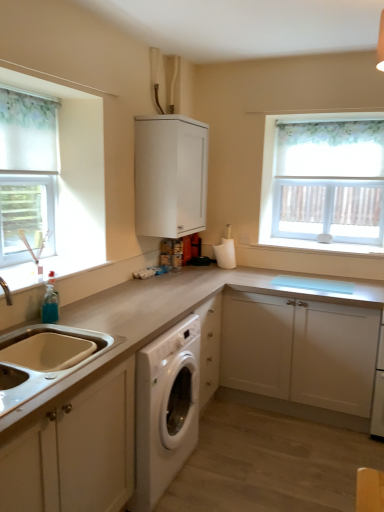
Question: Is white matte toilet paper holder at center closer to the viewer compared to white fabric curtain at left?

Choices:
 (A) no
 (B) yes

Answer: (A)

Question: Does white matte toilet paper holder at center appear on the right side of white fabric curtain at left?

Choices:
 (A) yes
 (B) no

Answer: (A)

Question: Is white fabric curtain at left at the back of white matte toilet paper holder at center?

Choices:
 (A) no
 (B) yes

Answer: (A)

Question: Is white matte toilet paper holder at center with white fabric curtain at left?

Choices:
 (A) no
 (B) yes

Answer: (A)

Question: Is white matte toilet paper holder at center positioned behind white fabric curtain at left?

Choices:
 (A) yes
 (B) no

Answer: (A)

Question: Considering the relative positions of white matte cabinet at center, which is the second cabinetry from front to back, and white matte cabinet at upper center, arranged as the 1th cabinetry when viewed from the back, in the image provided, is white matte cabinet at center, which is the second cabinetry from front to back, to the left or to the right of white matte cabinet at upper center, arranged as the 1th cabinetry when viewed from the back,?

Choices:
 (A) left
 (B) right

Answer: (B)

Question: Considering their positions, is white matte cabinet at center, arranged as the second cabinetry when viewed from the back, located in front of or behind white matte cabinet at upper center, which appears as the 2th cabinetry when viewed from the right?

Choices:
 (A) behind
 (B) front

Answer: (B)

Question: In terms of width, does white matte cabinet at center, which is the third cabinetry from left to right, look wider or thinner when compared to white matte cabinet at upper center, which is the 1th cabinetry in top-to-bottom order?

Choices:
 (A) thin
 (B) wide

Answer: (B)

Question: From a real-world perspective, relative to white matte cabinet at upper center, which is the 1th cabinetry in top-to-bottom order, is white matte cabinet at center, arranged as the 3th cabinetry when viewed from the top, vertically above or below?

Choices:
 (A) above
 (B) below

Answer: (B)

Question: From a real-world perspective, is white textured curtain at upper right above or below white matte cabinet at center, the 1th cabinetry viewed from the right?

Choices:
 (A) below
 (B) above

Answer: (B)

Question: Is white textured curtain at upper right to the left or to the right of white matte cabinet at center, arranged as the 3th cabinetry when viewed from the top, in the image?

Choices:
 (A) right
 (B) left

Answer: (A)

Question: From their relative heights in the image, would you say white textured curtain at upper right is taller or shorter than white matte cabinet at center, arranged as the second cabinetry when viewed from the back?

Choices:
 (A) short
 (B) tall

Answer: (B)

Question: From the image's perspective, is white textured curtain at upper right above or below white matte cabinet at center, the 1th cabinetry ordered from the bottom?

Choices:
 (A) above
 (B) below

Answer: (A)

Question: Considering the positions of white matte cabinet at center, the 1th cabinetry ordered from the bottom, and white matte sink at lower left, marked as the third cabinetry in a right-to-left arrangement, in the image, is white matte cabinet at center, the 1th cabinetry ordered from the bottom, wider or thinner than white matte sink at lower left, marked as the third cabinetry in a right-to-left arrangement,?

Choices:
 (A) wide
 (B) thin

Answer: (A)

Question: From the image's perspective, is white matte cabinet at center, the 1th cabinetry viewed from the right, positioned above or below white matte sink at lower left, which is the 1th cabinetry in left-to-right order?

Choices:
 (A) above
 (B) below

Answer: (B)